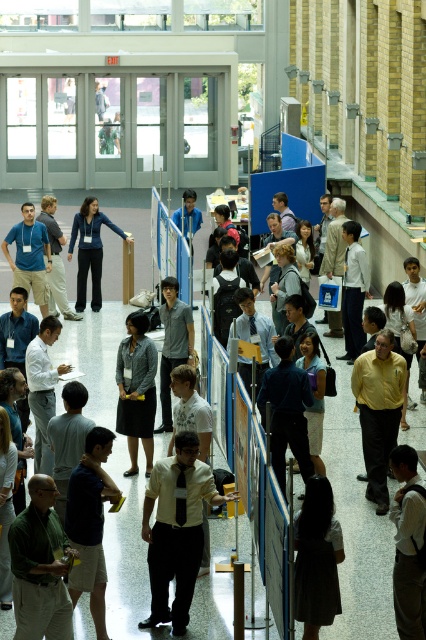
You are an attendee at this event and notice a gray fabric skirt at center in the foreground. Can you describe its exact location relative to the brick wall and the glass doors?

The gray fabric skirt at center is located at point (137, 388) in the image.

You are an attendee at this event and want to approach the gray fabric skirt at center and the matte blue jacket at center. Which one should you walk towards first if you want to greet them in the order they appear closest to you?

You should first greet the gray fabric skirt at center because it is closer to you than the matte blue jacket at center.